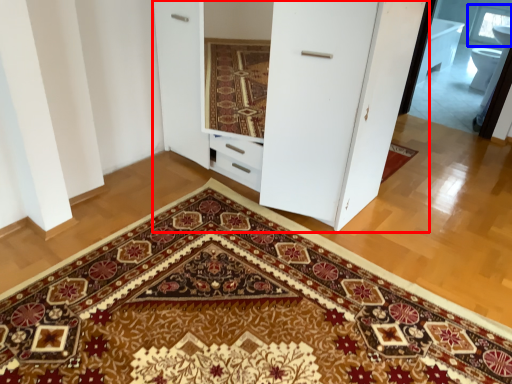
Question: Which object is closer to the camera taking this photo, dresser (highlighted by a red box) or window (highlighted by a blue box)?

Choices:
 (A) dresser
 (B) window

Answer: (A)